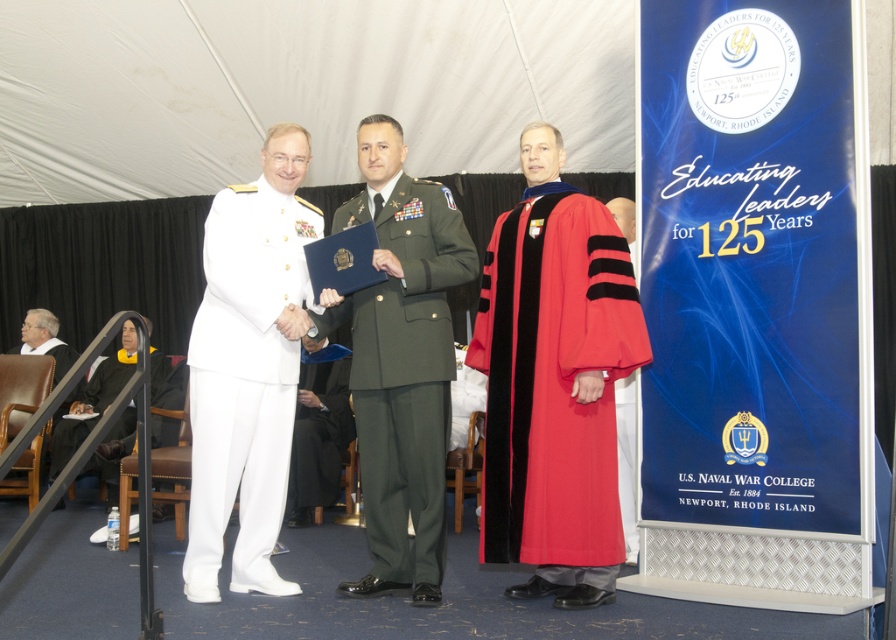
Image resolution: width=896 pixels, height=640 pixels. In order to click on green matte uniform at center in this screenshot , I will do point(406,378).

Which of these two, velvet red graduation gown at center or green matte uniform at center, stands shorter?

velvet red graduation gown at center is shorter.

Can you confirm if velvet red graduation gown at center is taller than green matte uniform at center?

No.

The image size is (896, 640). What are the coordinates of `velvet red graduation gown at center` in the screenshot? It's located at (554, 384).

The image size is (896, 640). Identify the location of velvet red graduation gown at center. (554, 384).

Does velvet red graduation gown at center have a lesser height compared to black fabric graduation gown at lower left?

No, velvet red graduation gown at center is not shorter than black fabric graduation gown at lower left.

From the picture: Who is shorter, velvet red graduation gown at center or black fabric graduation gown at lower left?

black fabric graduation gown at lower left

Image resolution: width=896 pixels, height=640 pixels. What are the coordinates of `velvet red graduation gown at center` in the screenshot? It's located at (554, 384).